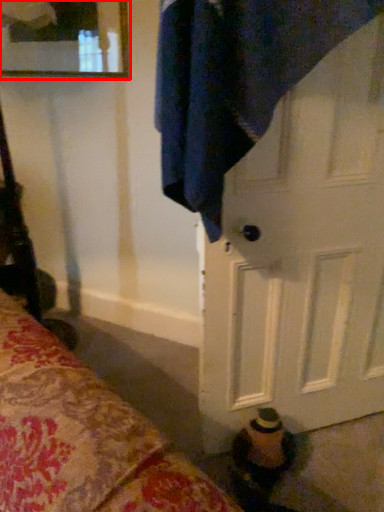
Question: Considering the relative positions of mirror (annotated by the red box) and door in the image provided, where is mirror (annotated by the red box) located with respect to the staircase?

Choices:
 (A) right
 (B) left

Answer: (B)